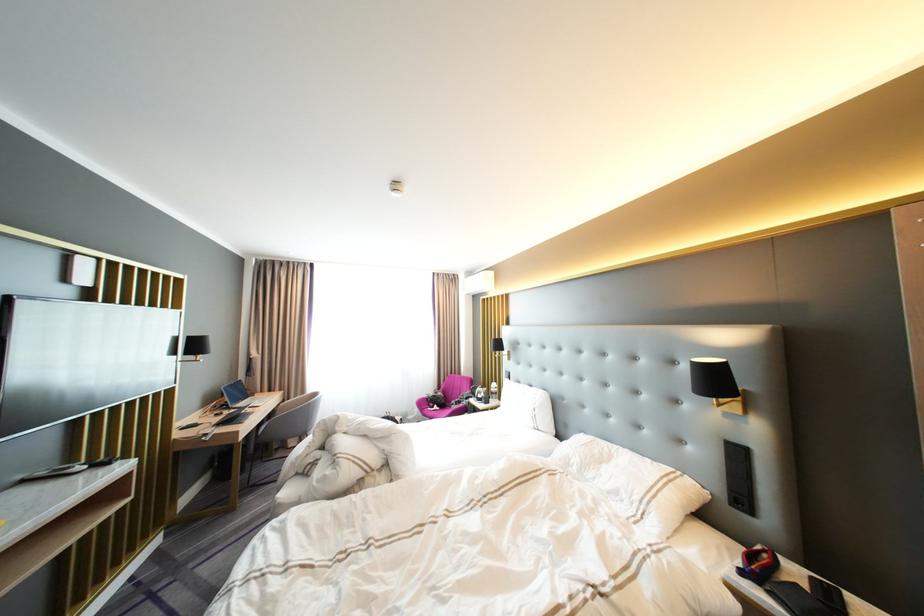
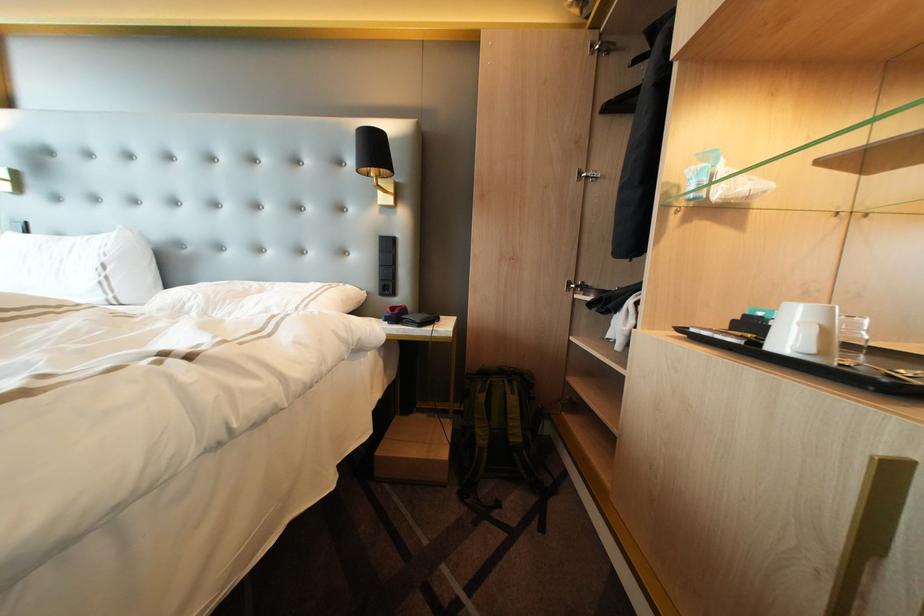
Question: The images are taken continuously from a first-person perspective. In which direction is your viewpoint rotating?

Choices:
 (A) Left
 (B) Right
 (C) Up
 (D) Down

Answer: (B)